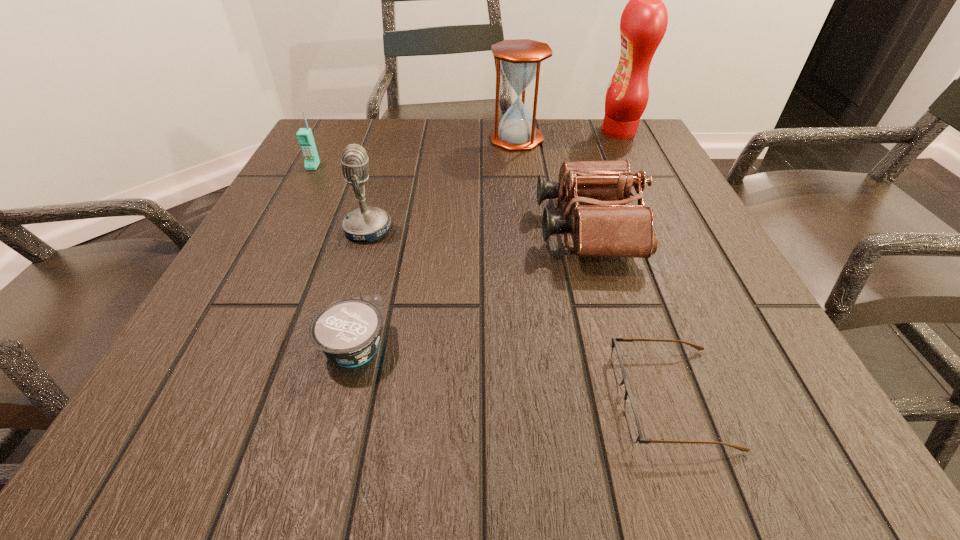
At what (x,y) coordinates should I click in order to perform the action: click on vacant space positioned 0.150m on the label side of the condiment. Please return your answer as a coordinate pair (x, y). The width and height of the screenshot is (960, 540). Looking at the image, I should click on (542, 132).

Find the location of a particular element. vacant space located on the front of the sixth shortest object is located at coordinates (524, 199).

Find the location of `vacant space located on the front-facing side of the microphone`. vacant space located on the front-facing side of the microphone is located at coordinates (569, 230).

Locate an element on the screen. The image size is (960, 540). vacant area situated 0.390m on the keypad of the cellular telephone is located at coordinates (245, 295).

You are a GUI agent. You are given a task and a screenshot of the screen. Output one action in this format:
    pyautogui.click(x=<x>, y=<y>)
    Task: Click on the vacant space situated 0.360m through the eyepieces of the binoculars
    The height and width of the screenshot is (540, 960).
    Given the screenshot: What is the action you would take?
    pyautogui.click(x=351, y=228)

At what (x,y) coordinates should I click in order to perform the action: click on free point located 0.110m through the eyepieces of the binoculars. Please return your answer as a coordinate pair (x, y). Image resolution: width=960 pixels, height=540 pixels. Looking at the image, I should click on (482, 228).

Identify the location of vacant space situated 0.080m through the eyepieces of the binoculars. This screenshot has width=960, height=540. (497, 228).

Where is `free location located 0.390m on the right of the sixth tallest object`? Image resolution: width=960 pixels, height=540 pixels. free location located 0.390m on the right of the sixth tallest object is located at coordinates (657, 347).

Locate an element on the screen. This screenshot has height=540, width=960. vacant region located 0.170m on the front-facing side of the shortest object is located at coordinates (492, 397).

The image size is (960, 540). I want to click on free space located 0.310m on the front-facing side of the shortest object, so click(x=385, y=397).